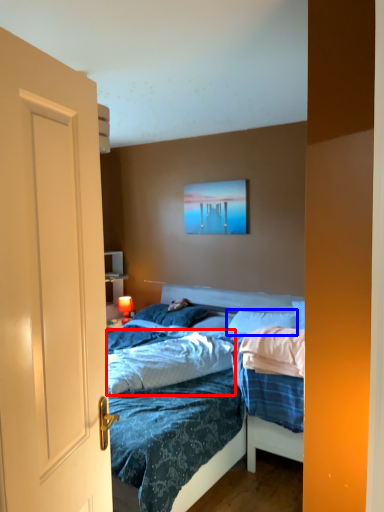
Question: Among these objects, which one is nearest to the camera, sheet (highlighted by a red box) or pillow (highlighted by a blue box)?

Choices:
 (A) sheet
 (B) pillow

Answer: (A)